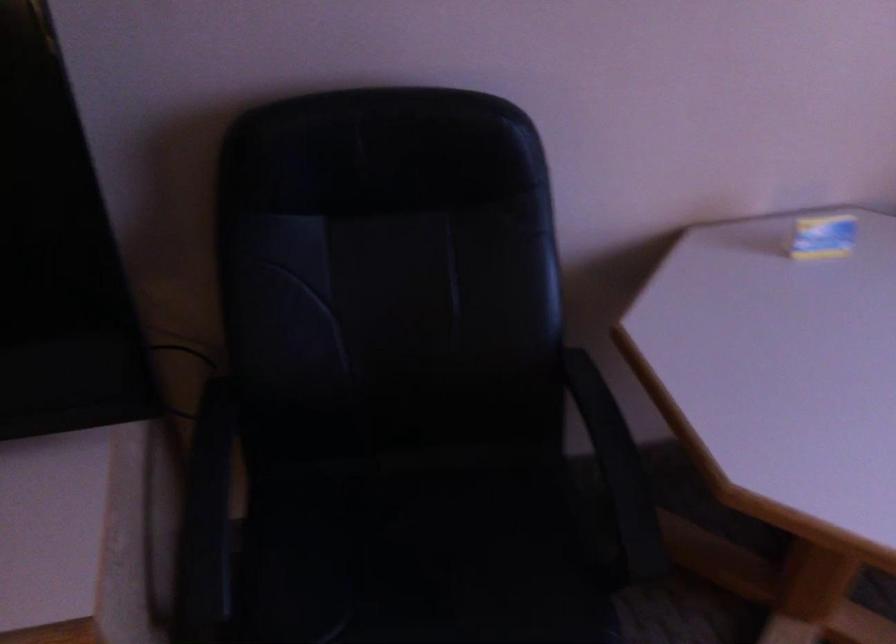
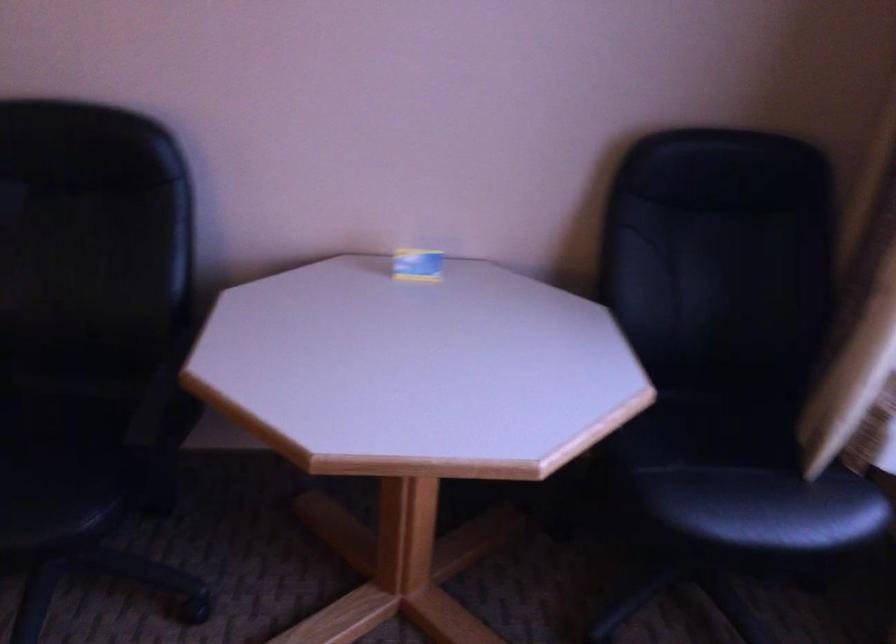
Question: The images are taken continuously from a first-person perspective. In which direction is your viewpoint rotating?

Choices:
 (A) Left
 (B) Right
 (C) Up
 (D) Down

Answer: (C)